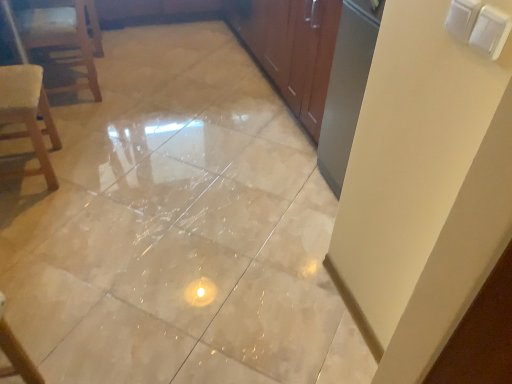
The image size is (512, 384). What are the coordinates of `space that is in front of wooden textured chair at left` in the screenshot? It's located at (33, 218).